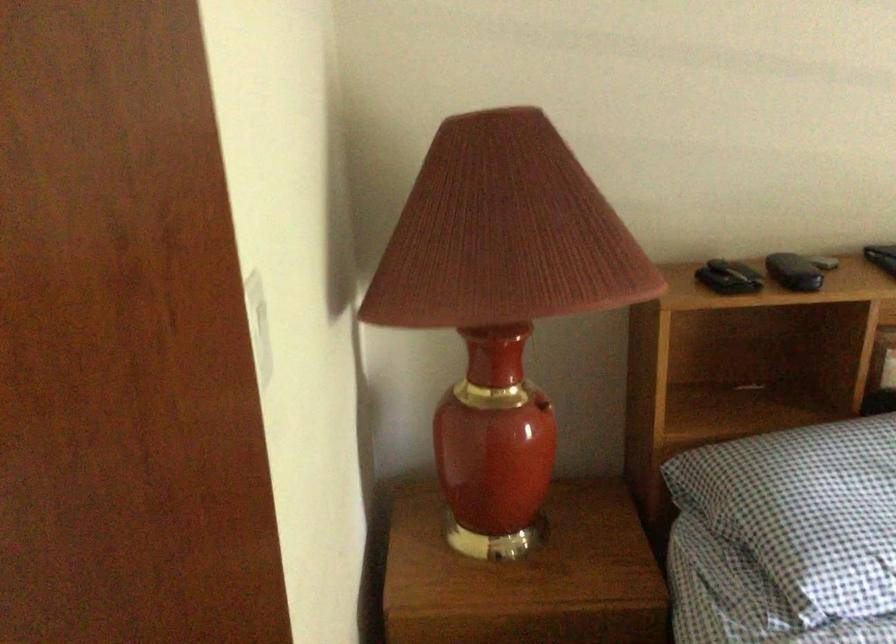
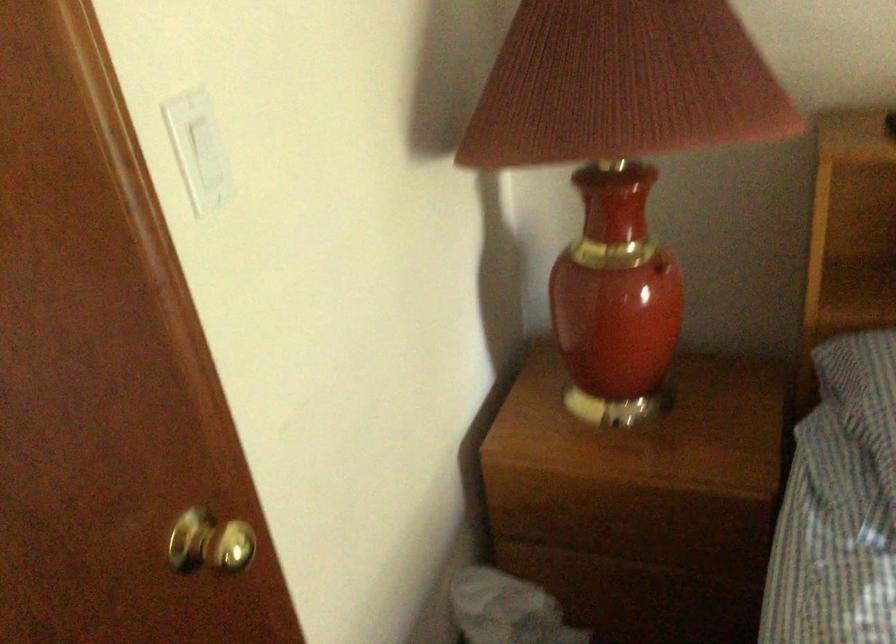
Find the pixel in the second image that matches point (541, 404) in the first image.

(661, 267)